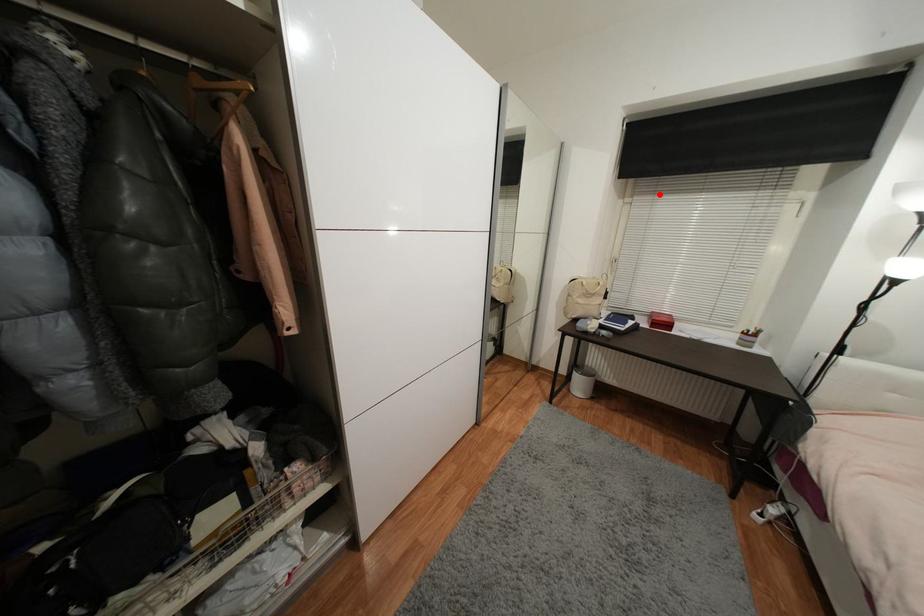
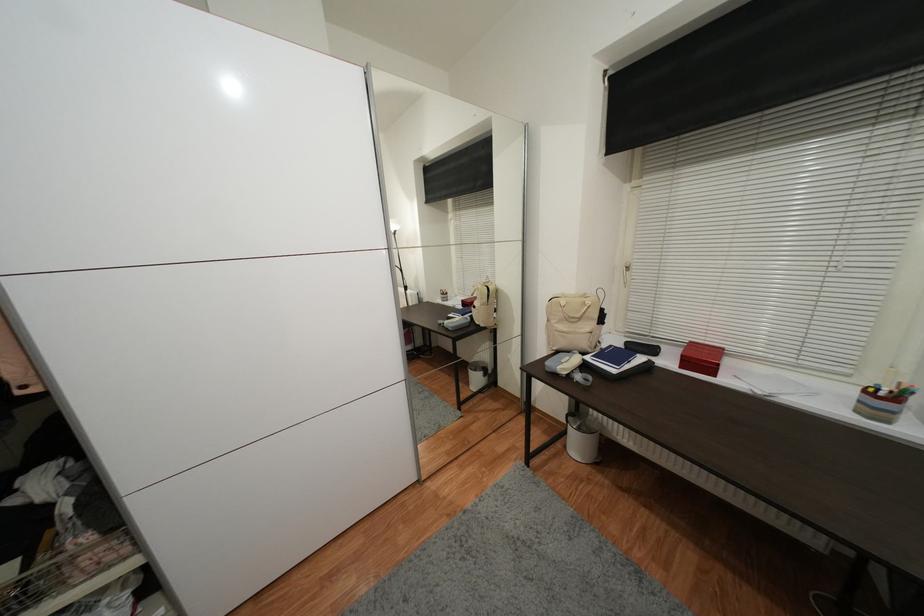
Question: I am providing you with two images of the same scene from different viewpoints. A red point is marked on the first image. Is the red point's position out of view in image 2?

Choices:
 (A) Yes
 (B) No

Answer: (B)